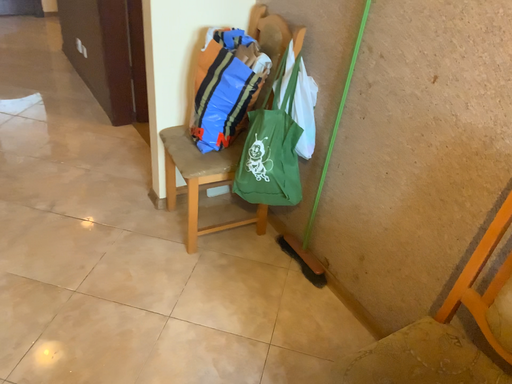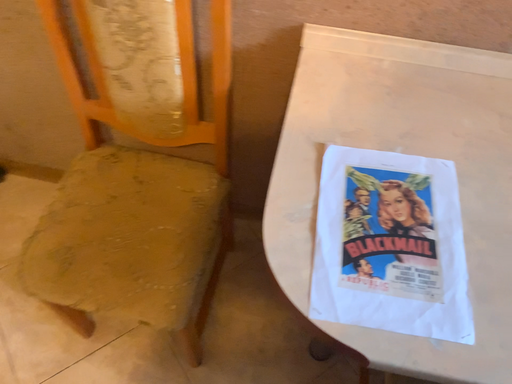
Question: Which way did the camera rotate in the video?

Choices:
 (A) rotated left
 (B) rotated right

Answer: (B)